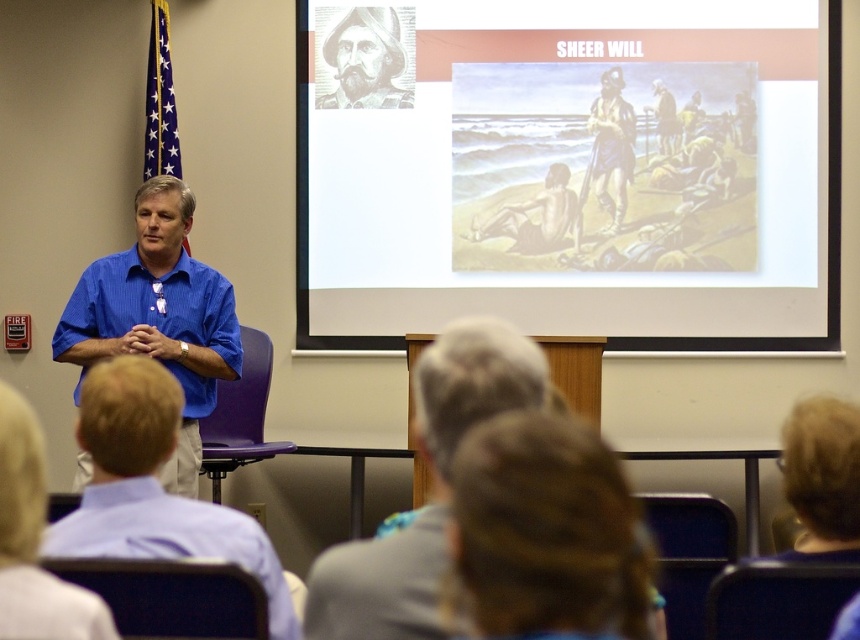
Question: Does light brown hair at lower left have a greater width compared to brown textured jacket at upper center?

Choices:
 (A) yes
 (B) no

Answer: (A)

Question: Which object appears closest to the camera in this image?

Choices:
 (A) blue shirt at center
 (B) light brown hair at lower left
 (C) blue striped shirt at left
 (D) matte paper poster at upper center

Answer: (A)

Question: Is matte paper poster at upper center bigger than blue striped shirt at left?

Choices:
 (A) yes
 (B) no

Answer: (A)

Question: Can you confirm if blue shirt at left is bigger than blue striped shirt at left?

Choices:
 (A) yes
 (B) no

Answer: (B)

Question: Which of the following is the closest to the observer?

Choices:
 (A) (265, 557)
 (B) (301, 90)

Answer: (A)

Question: Which object is positioned farthest from the brown textured jacket at upper center?

Choices:
 (A) blue shirt at left
 (B) light brown hair at lower left
 (C) gray textured portrait at upper center
 (D) brown hair at lower center

Answer: (B)